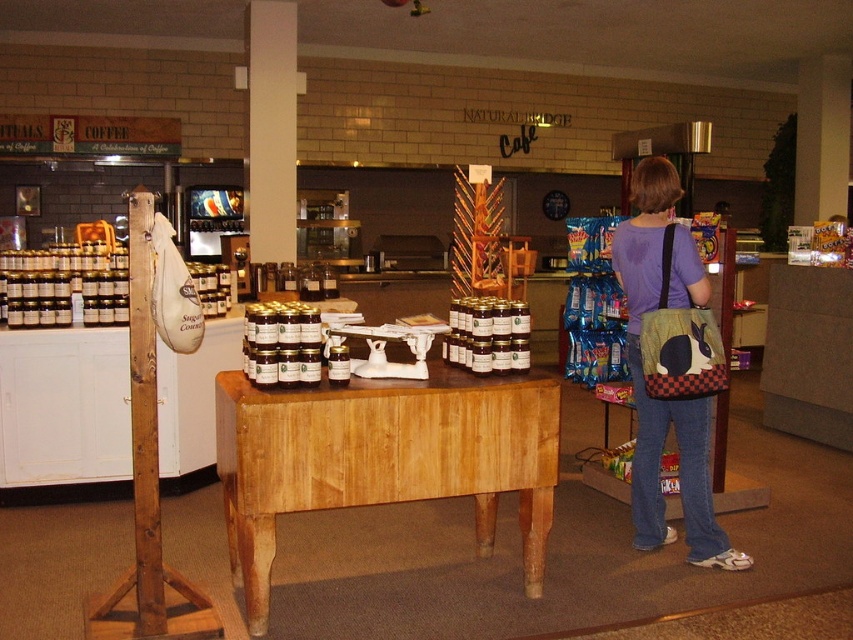
Question: Is light brown wood table at center wider than matte purple shirt at center?

Choices:
 (A) yes
 (B) no

Answer: (A)

Question: Is light brown wood table at center closer to camera compared to matte purple shirt at center?

Choices:
 (A) no
 (B) yes

Answer: (B)

Question: Which point is farther to the camera?

Choices:
 (A) (653, 438)
 (B) (405, 444)

Answer: (A)

Question: Which object appears farthest from the camera in this image?

Choices:
 (A) light brown wood table at center
 (B) matte purple shirt at center

Answer: (B)

Question: In this image, where is light brown wood table at center located relative to matte purple shirt at center?

Choices:
 (A) left
 (B) right

Answer: (A)